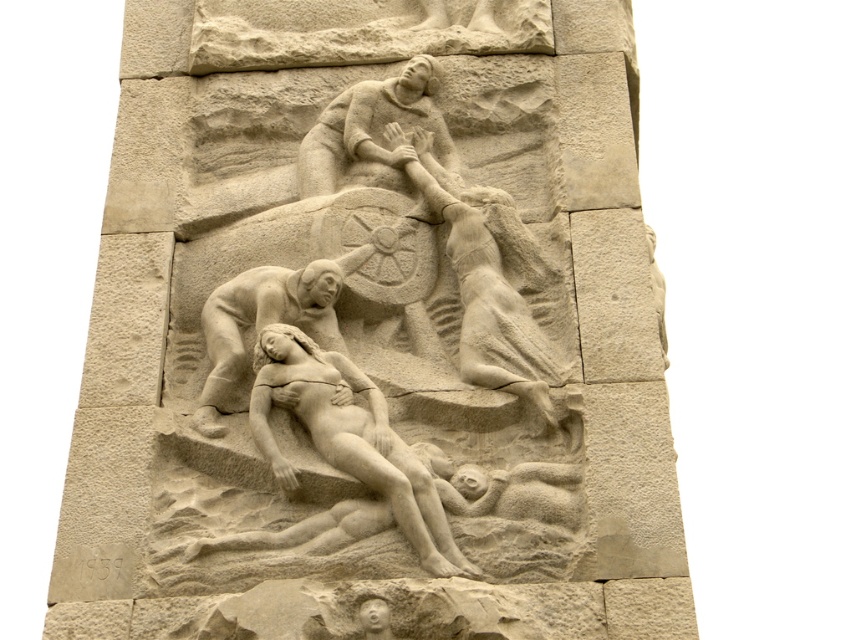
Does smooth stone warrior at center have a lesser height compared to smooth stone reclining figure at lower center?

Incorrect, smooth stone warrior at center's height does not fall short of smooth stone reclining figure at lower center's.

Is the position of smooth stone warrior at center more distant than that of smooth stone reclining figure at lower center?

Yes, it is behind smooth stone reclining figure at lower center.

Between point (500, 364) and point (263, 353), which one is positioned behind?

The point (500, 364) is behind.

Identify the location of smooth stone warrior at center. 488,278.

Is point (504, 365) positioned in front of point (292, 291)?

Yes, it is in front of point (292, 291).

Is point (514, 220) farther from viewer compared to point (242, 324)?

That is True.

Between point (491, 333) and point (296, 324), which one is positioned behind?

The point (296, 324) is more distant.

You are a GUI agent. You are given a task and a screenshot of the screen. Output one action in this format:
    pyautogui.click(x=<x>, y=<y>)
    Task: Click on the smooth stone warrior at center
    Image resolution: width=856 pixels, height=640 pixels.
    Given the screenshot: What is the action you would take?
    pyautogui.click(x=488, y=278)

Can you confirm if smooth stone reclining figure at lower center is wider than smooth beige reclining figure at center?

Indeed, smooth stone reclining figure at lower center has a greater width compared to smooth beige reclining figure at center.

Between point (317, 387) and point (352, 259), which one is positioned behind?

Positioned behind is point (352, 259).

This screenshot has width=856, height=640. I want to click on smooth stone reclining figure at lower center, so click(349, 438).